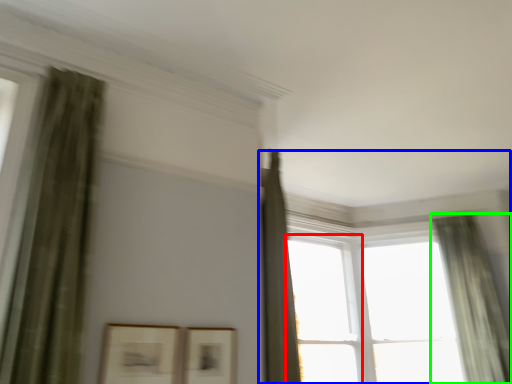
Question: Which object is positioned farthest from window (highlighted by a red box)? Select from window (highlighted by a blue box) and curtain (highlighted by a green box).

Choices:
 (A) window
 (B) curtain

Answer: (A)